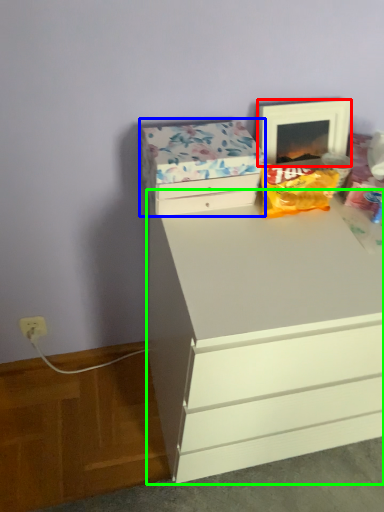
Question: Which object is the closest to the picture frame (highlighted by a red box)? Choose among these: storage box (highlighted by a blue box) or chest of drawers (highlighted by a green box).

Choices:
 (A) storage box
 (B) chest of drawers

Answer: (A)